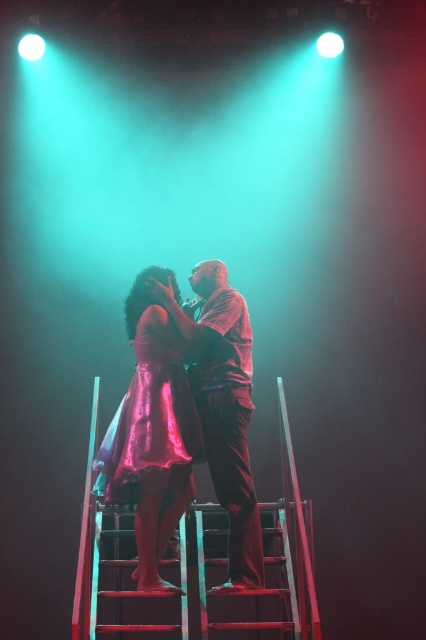
Which is more to the left, matte brown shirt at center or shiny pink dress at center?

Positioned to the left is shiny pink dress at center.

Can you confirm if matte brown shirt at center is taller than shiny pink dress at center?

Yes, matte brown shirt at center is taller than shiny pink dress at center.

Find the location of `matte brown shirt at center`. matte brown shirt at center is located at coordinates (224, 410).